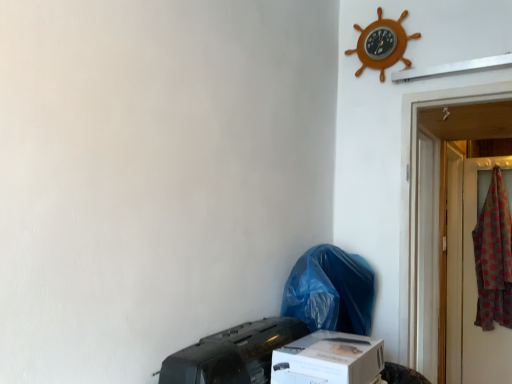
Question: Considering the relative sizes of black matte printer at lower center and blue plastic bag at lower center in the image provided, is black matte printer at lower center wider than blue plastic bag at lower center?

Choices:
 (A) yes
 (B) no

Answer: (B)

Question: Is black matte printer at lower center shorter than blue plastic bag at lower center?

Choices:
 (A) yes
 (B) no

Answer: (A)

Question: From the image's perspective, is black matte printer at lower center on blue plastic bag at lower center?

Choices:
 (A) yes
 (B) no

Answer: (B)

Question: Is black matte printer at lower center bigger than blue plastic bag at lower center?

Choices:
 (A) no
 (B) yes

Answer: (A)

Question: From a real-world perspective, is black matte printer at lower center located higher than blue plastic bag at lower center?

Choices:
 (A) yes
 (B) no

Answer: (B)

Question: From a real-world perspective, is black matte printer at lower center physically located above or below white cardboard box at lower center?

Choices:
 (A) above
 (B) below

Answer: (A)

Question: In terms of height, does black matte printer at lower center look taller or shorter compared to white cardboard box at lower center?

Choices:
 (A) short
 (B) tall

Answer: (B)

Question: From the image's perspective, is black matte printer at lower center located above or below white cardboard box at lower center?

Choices:
 (A) above
 (B) below

Answer: (A)

Question: Does point (182, 382) appear closer or farther from the camera than point (313, 334)?

Choices:
 (A) closer
 (B) farther

Answer: (A)

Question: Is wooden ship wheel at upper right inside or outside of white cardboard box at lower center?

Choices:
 (A) inside
 (B) outside

Answer: (B)

Question: Considering the positions of wooden ship wheel at upper right and white cardboard box at lower center in the image, is wooden ship wheel at upper right taller or shorter than white cardboard box at lower center?

Choices:
 (A) short
 (B) tall

Answer: (B)

Question: From the image's perspective, relative to white cardboard box at lower center, is wooden ship wheel at upper right above or below?

Choices:
 (A) above
 (B) below

Answer: (A)

Question: From a real-world perspective, is wooden ship wheel at upper right physically located above or below white cardboard box at lower center?

Choices:
 (A) below
 (B) above

Answer: (B)

Question: From a real-world perspective, is blue plastic bag at lower center positioned above or below white cardboard box at lower center?

Choices:
 (A) above
 (B) below

Answer: (A)

Question: In the image, is blue plastic bag at lower center positioned in front of or behind white cardboard box at lower center?

Choices:
 (A) front
 (B) behind

Answer: (B)